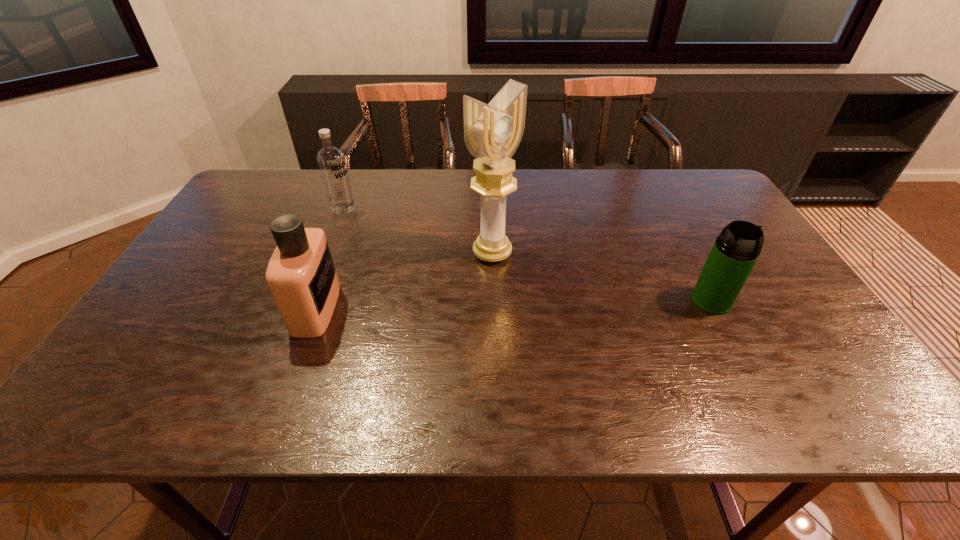
This screenshot has width=960, height=540. Find the location of `vacant space on the desktop that is between the perfume and the rightmost object and is positioned on the front-facing side of the tallest object`. vacant space on the desktop that is between the perfume and the rightmost object and is positioned on the front-facing side of the tallest object is located at coordinates click(x=566, y=303).

Locate an element on the screen. The width and height of the screenshot is (960, 540). free spot on the desktop that is between the perfume and the rightmost object and is positioned on the front label of the farthest object is located at coordinates (497, 305).